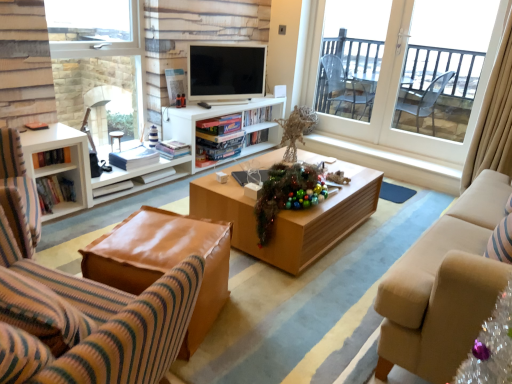
What are the coordinates of `transparent glass door at upper right, which is counted as the second window, starting from the left` in the screenshot? It's located at tap(397, 91).

Measure the distance between matte white television at center and camera.

The depth of matte white television at center is 3.47 meters.

Where is `white matte entertainment center at center`? white matte entertainment center at center is located at coordinates (191, 147).

Where is `clear glass window at left, acting as the second window starting from the right`? The height and width of the screenshot is (384, 512). clear glass window at left, acting as the second window starting from the right is located at coordinates (97, 65).

Considering the positions of point (335, 226) and point (130, 125), is point (335, 226) closer or farther from the camera than point (130, 125)?

Point (335, 226) is closer to the camera than point (130, 125).

Considering the sizes of objects wooden coffee table at center and clear glass window at left, arranged as the first window when viewed from the left, in the image provided, who is shorter, wooden coffee table at center or clear glass window at left, arranged as the first window when viewed from the left,?

Standing shorter between the two is wooden coffee table at center.

Considering the relative sizes of wooden coffee table at center and clear glass window at left, arranged as the first window when viewed from the left, in the image provided, is wooden coffee table at center bigger than clear glass window at left, arranged as the first window when viewed from the left,?

Yes.

Considering the sizes of objects matte white television at center and transparent glass door at upper right, the first window in the right-to-left sequence, in the image provided, who is shorter, matte white television at center or transparent glass door at upper right, the first window in the right-to-left sequence,?

Standing shorter between the two is matte white television at center.

Considering the points (195, 68) and (496, 39), which point is in front, point (195, 68) or point (496, 39)?

The point (496, 39) is more forward.

Can transparent glass door at upper right, the first window in the right-to-left sequence, be found inside matte white television at center?

No, transparent glass door at upper right, the first window in the right-to-left sequence, is not a part of matte white television at center.

At what (x,y) coordinates should I click in order to perform the action: click on window located above the matte white television at center (from a real-world perspective). Please return your answer as a coordinate pair (x, y). Looking at the image, I should click on (397, 91).

Is white matte entertainment center at center bigger or smaller than beige fabric couch at right?

Clearly, white matte entertainment center at center is smaller in size than beige fabric couch at right.

Could you tell me if white matte entertainment center at center is turned towards beige fabric couch at right?

Yes, white matte entertainment center at center is turned towards beige fabric couch at right.

Is white matte entertainment center at center in contact with beige fabric couch at right?

No, white matte entertainment center at center is not beside beige fabric couch at right.

From the image's perspective, who appears lower, white matte entertainment center at center or beige fabric couch at right?

beige fabric couch at right is shown below in the image.

Which of these two, beige fabric couch at right or leather ottoman at lower left, is smaller?

With smaller size is leather ottoman at lower left.

Who is taller, beige fabric couch at right or leather ottoman at lower left?

beige fabric couch at right.

In the image, there is a leather ottoman at lower left. Identify the location of studio couch above it (from the image's perspective). (444, 286).

Which is more to the left, beige fabric couch at right or leather ottoman at lower left?

leather ottoman at lower left.

Which object is positioned more to the right, leather at left or beige fabric couch at right?

From the viewer's perspective, beige fabric couch at right appears more on the right side.

Considering their positions, is leather at left located in front of or behind beige fabric couch at right?

In the image, leather at left appears in front of beige fabric couch at right.

From a real-world perspective, between leather at left and beige fabric couch at right, who is vertically lower?

leather at left, from a real-world perspective.

Which point is more forward, (97,352) or (450,281)?

Positioned in front is point (97,352).

Is beige fabric couch at right aimed at beige fabric curtain at right?

No, beige fabric couch at right is not aimed at beige fabric curtain at right.

Can you confirm if beige fabric couch at right is smaller than beige fabric curtain at right?

Actually, beige fabric couch at right might be larger than beige fabric curtain at right.

Which object is positioned more to the right, beige fabric couch at right or beige fabric curtain at right?

Positioned to the right is beige fabric curtain at right.

Is beige fabric couch at right not close to beige fabric curtain at right?

Yes.

In the scene shown: Does shiny metallic garland at center have a lesser height compared to beige fabric couch at right?

Yes, shiny metallic garland at center is shorter than beige fabric couch at right.

Which object is closer to the camera, shiny metallic garland at center or beige fabric couch at right?

beige fabric couch at right is closer to the camera.

From the image's perspective, is shiny metallic garland at center located beneath beige fabric couch at right?

Incorrect, from the image's perspective, shiny metallic garland at center is higher than beige fabric couch at right.

Does shiny metallic garland at center appear on the right side of beige fabric couch at right?

No.

I want to click on coffee table that appears on the right of clear glass window at left, acting as the second window starting from the right, so click(x=290, y=217).

Identify the location of television lying below the transparent glass door at upper right, which is counted as the second window, starting from the left (from the image's perspective). The image size is (512, 384). (226, 71).

Considering their positions, is wooden coffee table at center positioned closer to leather at left than shiny metallic garland at center?

Based on the image, shiny metallic garland at center appears to be nearer to leather at left.

Looking at the image, which one is located further to leather ottoman at lower left, transparent glass door at upper right, which is counted as the second window, starting from the left, or wooden coffee table at center?

transparent glass door at upper right, which is counted as the second window, starting from the left.

From the picture: Which object lies further to the anchor point leather at left, matte white television at center or wooden coffee table at center?

matte white television at center is further to leather at left.

Based on their spatial positions, is white matte entertainment center at center or clear glass window at left, arranged as the first window when viewed from the left, closer to wooden coffee table at center?

white matte entertainment center at center.

Estimate the real-world distances between objects in this image. Which object is closer to transparent glass door at upper right, the first window in the right-to-left sequence, beige fabric curtain at right or white matte entertainment center at center?

Based on the image, beige fabric curtain at right appears to be nearer to transparent glass door at upper right, the first window in the right-to-left sequence.

When comparing their distances from beige fabric curtain at right, does clear glass window at left, arranged as the first window when viewed from the left, or shiny metallic garland at center seem closer?

shiny metallic garland at center is closer to beige fabric curtain at right.

Looking at the image, which one is located further to leather at left, white matte entertainment center at center or shiny metallic garland at center?

white matte entertainment center at center is further to leather at left.

Based on their spatial positions, is wooden coffee table at center or clear glass window at left, acting as the second window starting from the right, closer to leather ottoman at lower left?

wooden coffee table at center lies closer to leather ottoman at lower left than the other object.

Where is `entertainment center located between leather at left and clear glass window at left, arranged as the first window when viewed from the left, in the depth direction`? Image resolution: width=512 pixels, height=384 pixels. entertainment center located between leather at left and clear glass window at left, arranged as the first window when viewed from the left, in the depth direction is located at coordinates (191, 147).

The image size is (512, 384). I want to click on curtain between leather at left and transparent glass door at upper right, the first window in the right-to-left sequence, in the front-back direction, so click(494, 118).

Identify the location of christmas decoration between clear glass window at left, arranged as the first window when viewed from the left, and beige fabric curtain at right, in the horizontal direction. (287, 194).

The image size is (512, 384). Identify the location of table between beige fabric couch at right and transparent glass door at upper right, which is counted as the second window, starting from the left, in the front-back direction. (164, 260).